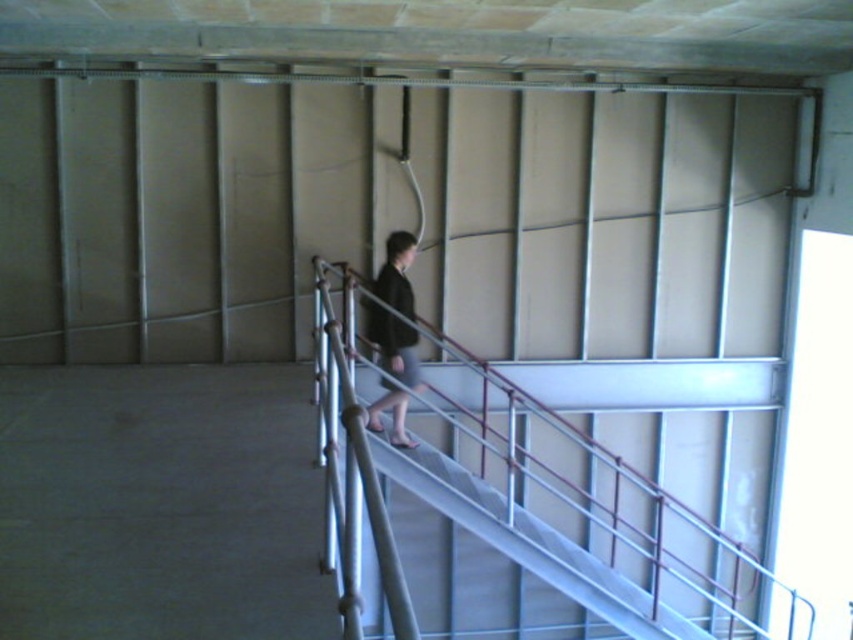
Does metallic silver handrail at center have a greater width compared to dark gray fabric dress at center?

Indeed, metallic silver handrail at center has a greater width compared to dark gray fabric dress at center.

Who is more forward, (578,573) or (415,362)?

Point (578,573)

The image size is (853, 640). Identify the location of metallic silver handrail at center. (518, 493).